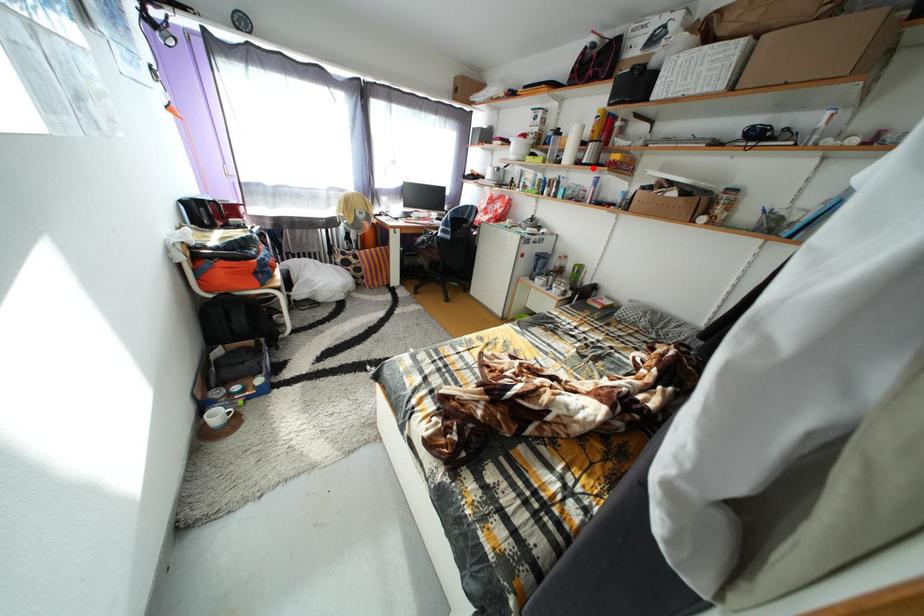
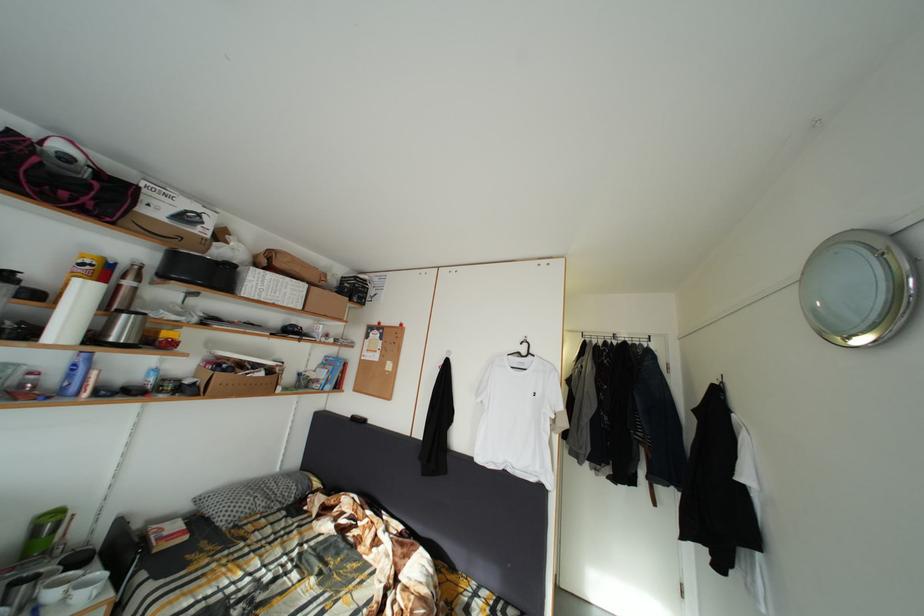
The point at the highlighted location is marked in the first image. Where is the corresponding point in the second image?

(120, 345)